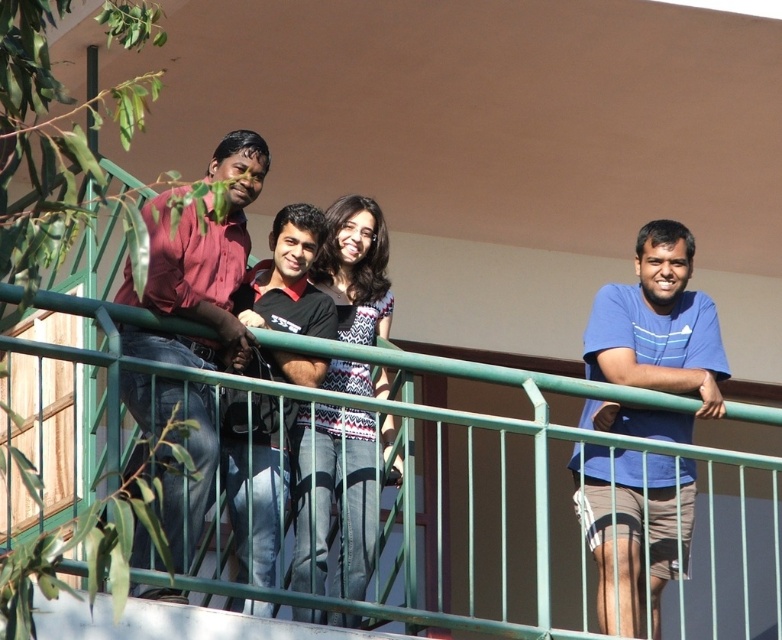
How far apart are green metal railing at center and black cotton shirt at center?

The distance of green metal railing at center from black cotton shirt at center is 22.47 feet.

Is green metal railing at center taller than black cotton shirt at center?

Yes.

Is point (766, 598) closer to camera compared to point (228, 497)?

No, it is behind (228, 497).

Find the location of `green metal railing at center`. green metal railing at center is located at coordinates (381, 496).

Who is more forward, (777, 522) or (673, 358)?

Point (673, 358)

Image resolution: width=782 pixels, height=640 pixels. Identify the location of green metal railing at center. pos(381,496).

The width and height of the screenshot is (782, 640). I want to click on green metal railing at center, so click(x=381, y=496).

Can you confirm if blue cotton shirt at right is positioned to the right of matte red shirt at left?

Correct, you'll find blue cotton shirt at right to the right of matte red shirt at left.

Which is above, blue cotton shirt at right or matte red shirt at left?

matte red shirt at left

Identify the location of blue cotton shirt at right. (658, 324).